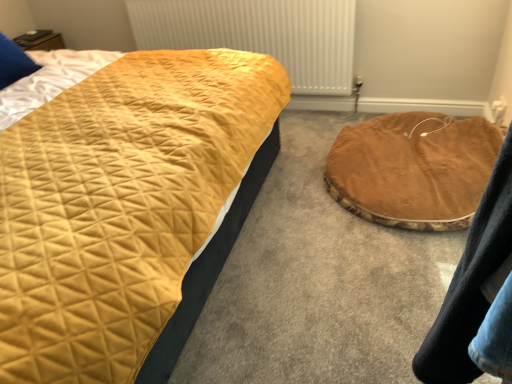
Question: Could metallic white radiator at upper center be considered to be inside brown plush pet bed at center?

Choices:
 (A) yes
 (B) no

Answer: (B)

Question: From a real-world perspective, is brown plush pet bed at center positioned over metallic white radiator at upper center based on gravity?

Choices:
 (A) yes
 (B) no

Answer: (A)

Question: Can you confirm if brown plush pet bed at center is thinner than metallic white radiator at upper center?

Choices:
 (A) no
 (B) yes

Answer: (A)

Question: Is brown plush pet bed at center further to camera compared to metallic white radiator at upper center?

Choices:
 (A) yes
 (B) no

Answer: (B)

Question: Does brown plush pet bed at center appear on the left side of metallic white radiator at upper center?

Choices:
 (A) yes
 (B) no

Answer: (B)

Question: Is brown plush pet bed at center positioned in front of metallic white radiator at upper center?

Choices:
 (A) no
 (B) yes

Answer: (B)

Question: From a real-world perspective, is metallic white radiator at upper center over brown plush pet bed at center?

Choices:
 (A) yes
 (B) no

Answer: (B)

Question: Would you say metallic white radiator at upper center is outside brown plush pet bed at center?

Choices:
 (A) yes
 (B) no

Answer: (A)

Question: Can you confirm if metallic white radiator at upper center is wider than brown plush pet bed at center?

Choices:
 (A) no
 (B) yes

Answer: (A)

Question: Does metallic white radiator at upper center have a larger size compared to brown plush pet bed at center?

Choices:
 (A) yes
 (B) no

Answer: (A)

Question: Are metallic white radiator at upper center and brown plush pet bed at center far apart?

Choices:
 (A) yes
 (B) no

Answer: (A)

Question: Is metallic white radiator at upper center at the right side of brown plush pet bed at center?

Choices:
 (A) yes
 (B) no

Answer: (B)

Question: Is metallic white radiator at upper center at the left side of brown velvety cat bed at lower right?

Choices:
 (A) yes
 (B) no

Answer: (A)